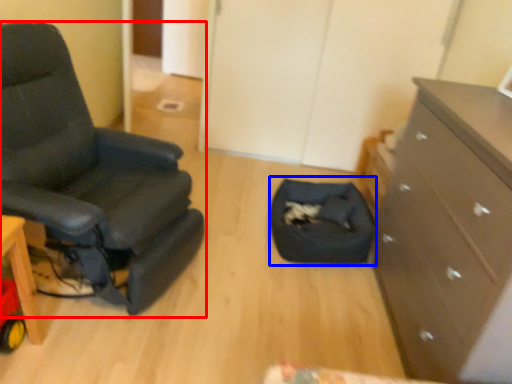
Question: Which of the following is the farthest to the observer, chair (highlighted by a red box) or footrest (highlighted by a blue box)?

Choices:
 (A) chair
 (B) footrest

Answer: (B)